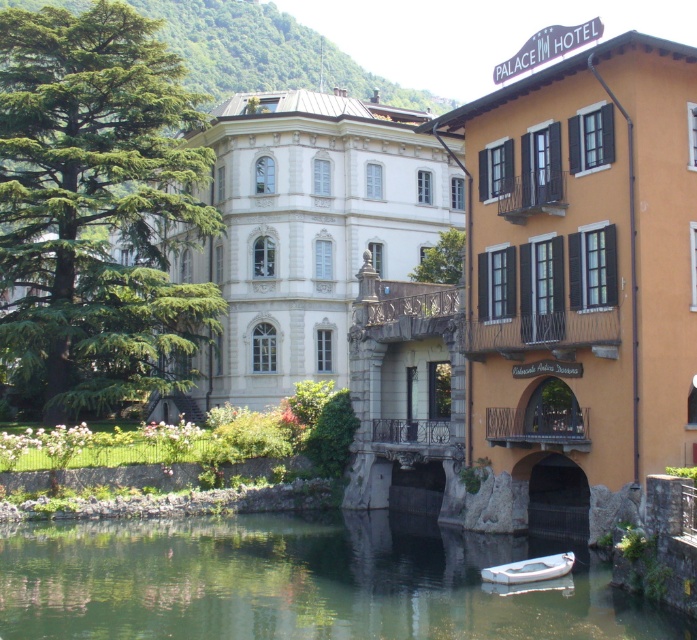
You are a GUI agent. You are given a task and a screenshot of the screen. Output one action in this format:
    pyautogui.click(x=<x>, y=<y>)
    Task: Click on the green smooth water at lower center
    The height and width of the screenshot is (640, 697).
    Given the screenshot: What is the action you would take?
    pyautogui.click(x=300, y=580)

Is green smooth water at lower center taller than white plastic boat at lower center?

Yes.

Who is more forward, (20, 624) or (562, 552)?

Point (20, 624) is more forward.

The height and width of the screenshot is (640, 697). In order to click on green smooth water at lower center in this screenshot , I will do `click(300, 580)`.